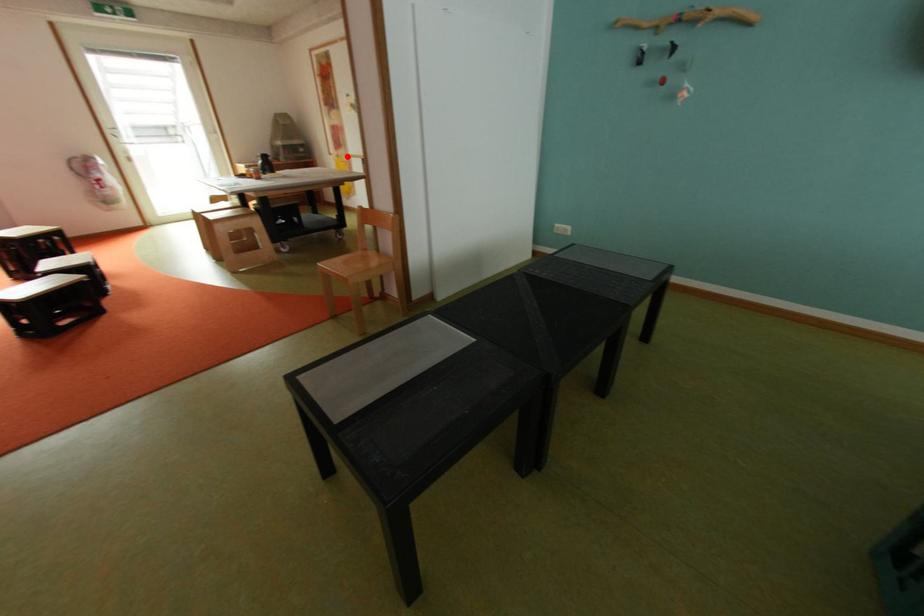
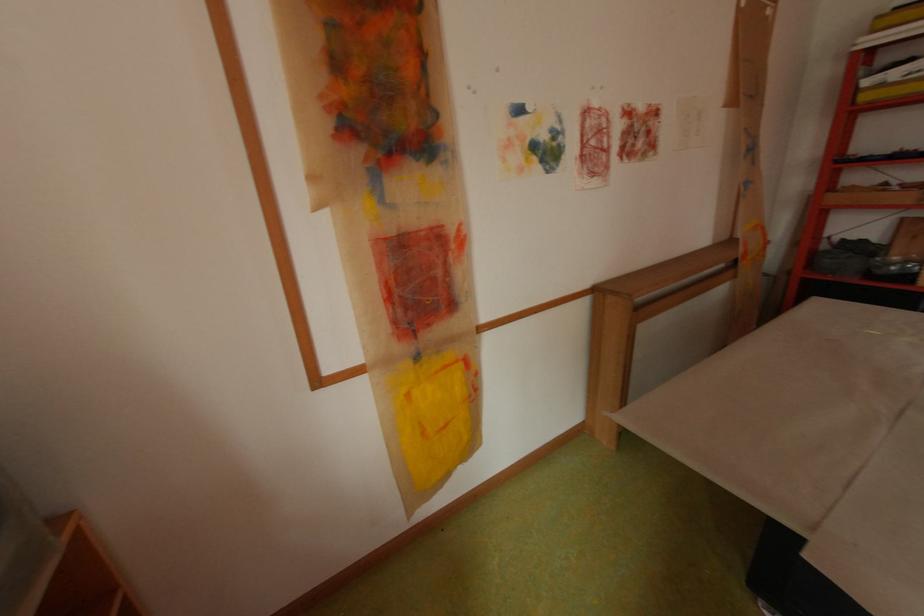
Question: I am providing you with two images of the same scene from different viewpoints. Given a red point in image1, look at the same physical point in image2. Is it:

Choices:
 (A) Closer to the viewpoint
 (B) Farther from the viewpoint

Answer: (B)